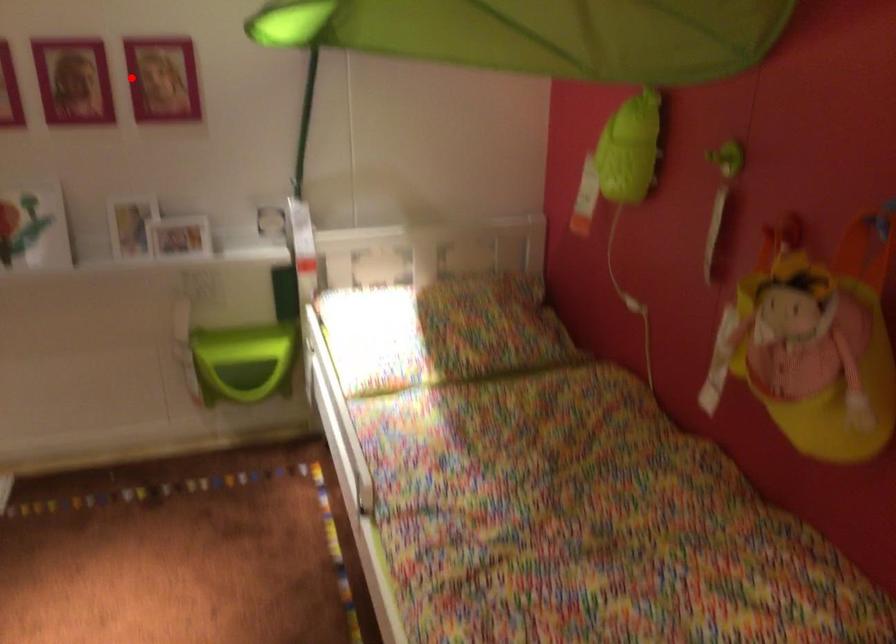
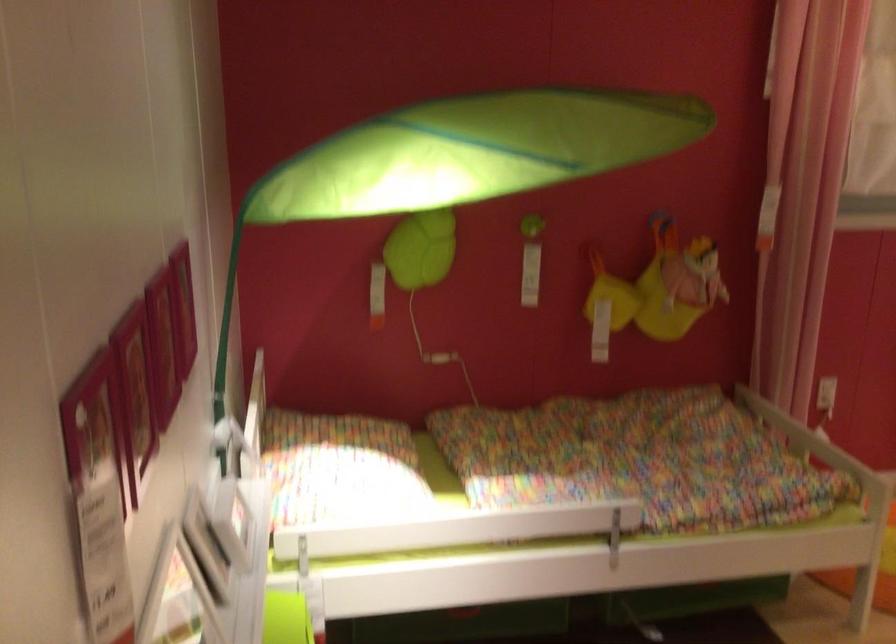
Find the pixel in the second image that matches the highlighted location in the first image.

(183, 308)